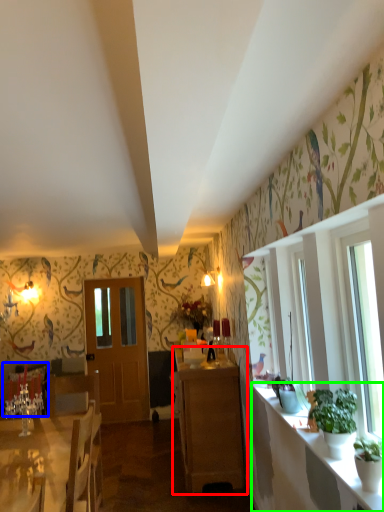
Question: Considering the real-world distances, which object is farthest from cabinetry (highlighted by a red box)? armchair (highlighted by a blue box) or counter top (highlighted by a green box)?

Choices:
 (A) armchair
 (B) counter top

Answer: (A)